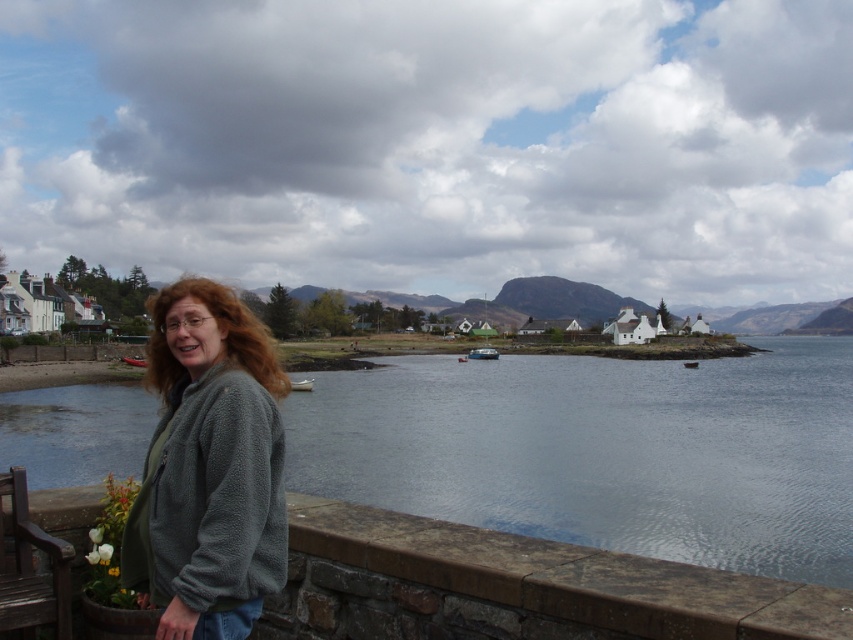
Question: Which point is closer to the camera taking this photo?

Choices:
 (A) (764, 353)
 (B) (38, 588)

Answer: (B)

Question: Which is nearer to the gray fleece jacket at lower left?

Choices:
 (A) clear water at lower left
 (B) wooden park bench at lower left

Answer: (B)

Question: Can you confirm if clear water at lower left is positioned to the right of gray fleece jacket at lower left?

Choices:
 (A) no
 (B) yes

Answer: (B)

Question: Can you confirm if clear water at lower left is positioned above gray fleece jacket at lower left?

Choices:
 (A) no
 (B) yes

Answer: (A)

Question: Among these points, which one is nearest to the camera?

Choices:
 (A) (450, 416)
 (B) (142, 515)

Answer: (B)

Question: From the image, what is the correct spatial relationship of clear water at lower left in relation to wooden park bench at lower left?

Choices:
 (A) below
 (B) above

Answer: (A)